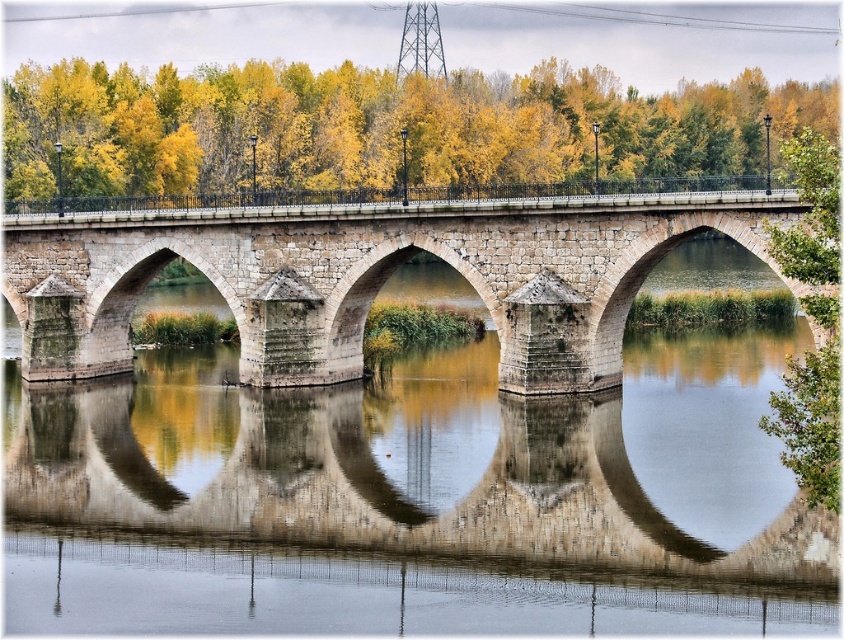
Between stone bridge at center and yellow leaves at center, which one is positioned lower?

Positioned lower is stone bridge at center.

Is stone bridge at center above yellow leaves at center?

Incorrect, stone bridge at center is not positioned above yellow leaves at center.

Locate an element on the screen. This screenshot has width=844, height=640. stone bridge at center is located at coordinates (368, 276).

Which is below, smooth stone water at center or stone bridge at center?

smooth stone water at center

Looking at this image, can you confirm if smooth stone water at center is positioned below stone bridge at center?

Yes, smooth stone water at center is below stone bridge at center.

This screenshot has width=844, height=640. Identify the location of smooth stone water at center. (437, 461).

Where is `smooth stone water at center`? smooth stone water at center is located at coordinates (437, 461).

Can you confirm if stone bridge at center is positioned below green leafy tree at right?

Yes.

Does stone bridge at center have a smaller size compared to green leafy tree at right?

Indeed, stone bridge at center has a smaller size compared to green leafy tree at right.

Which is in front, point (160, 262) or point (805, 381)?

Point (805, 381) is more forward.

Image resolution: width=844 pixels, height=640 pixels. I want to click on stone bridge at center, so click(368, 276).